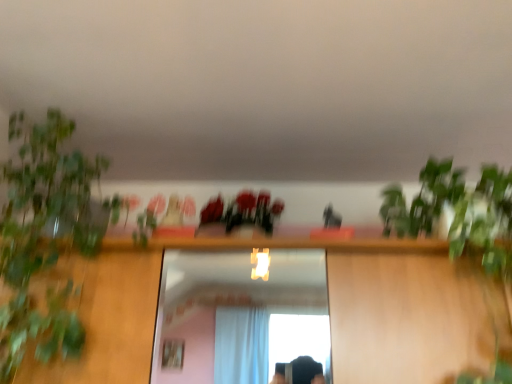
Question: Should I look upward or downward to see green leafy plant at left?

Choices:
 (A) up
 (B) down

Answer: (B)

Question: Considering the relative positions of matte plastic flowers at center and green leafy plant at left in the image provided, is matte plastic flowers at center to the left of green leafy plant at left from the viewer's perspective?

Choices:
 (A) yes
 (B) no

Answer: (B)

Question: Is matte plastic flowers at center not near green leafy plant at left?

Choices:
 (A) no
 (B) yes

Answer: (A)

Question: Considering the relative sizes of matte plastic flowers at center and green leafy plant at left in the image provided, is matte plastic flowers at center thinner than green leafy plant at left?

Choices:
 (A) no
 (B) yes

Answer: (B)

Question: Is matte plastic flowers at center further to camera compared to green leafy plant at left?

Choices:
 (A) no
 (B) yes

Answer: (B)

Question: Is matte plastic flowers at center smaller than green leafy plant at left?

Choices:
 (A) yes
 (B) no

Answer: (A)

Question: Is matte plastic flowers at center in front of green leafy plant at left?

Choices:
 (A) yes
 (B) no

Answer: (B)

Question: Considering the relative sizes of green leafy plant at left and matte plastic flowers at center in the image provided, is green leafy plant at left taller than matte plastic flowers at center?

Choices:
 (A) no
 (B) yes

Answer: (B)

Question: From a real-world perspective, does green leafy plant at left sit lower than matte plastic flowers at center?

Choices:
 (A) yes
 (B) no

Answer: (A)

Question: Is green leafy plant at left looking in the opposite direction of matte plastic flowers at center?

Choices:
 (A) yes
 (B) no

Answer: (B)

Question: Could you tell me if green leafy plant at left is facing matte plastic flowers at center?

Choices:
 (A) no
 (B) yes

Answer: (A)

Question: Considering the relative sizes of green leafy plant at left and matte plastic flowers at center in the image provided, is green leafy plant at left shorter than matte plastic flowers at center?

Choices:
 (A) no
 (B) yes

Answer: (A)

Question: Considering the relative sizes of green leafy plant at left and matte plastic flowers at center in the image provided, is green leafy plant at left smaller than matte plastic flowers at center?

Choices:
 (A) yes
 (B) no

Answer: (B)

Question: Do you think matte plastic flowers at center is within green leafy plant at left, or outside of it?

Choices:
 (A) inside
 (B) outside

Answer: (B)